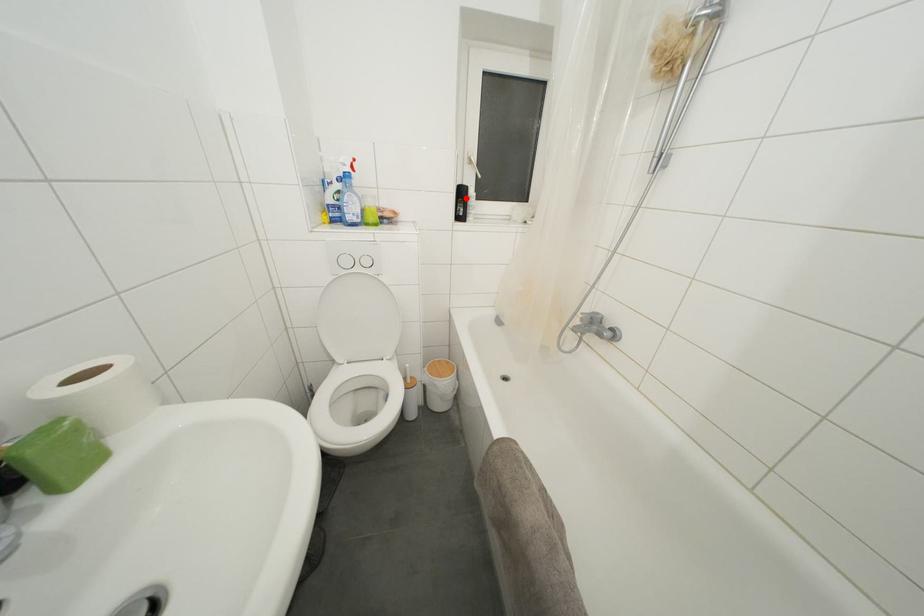
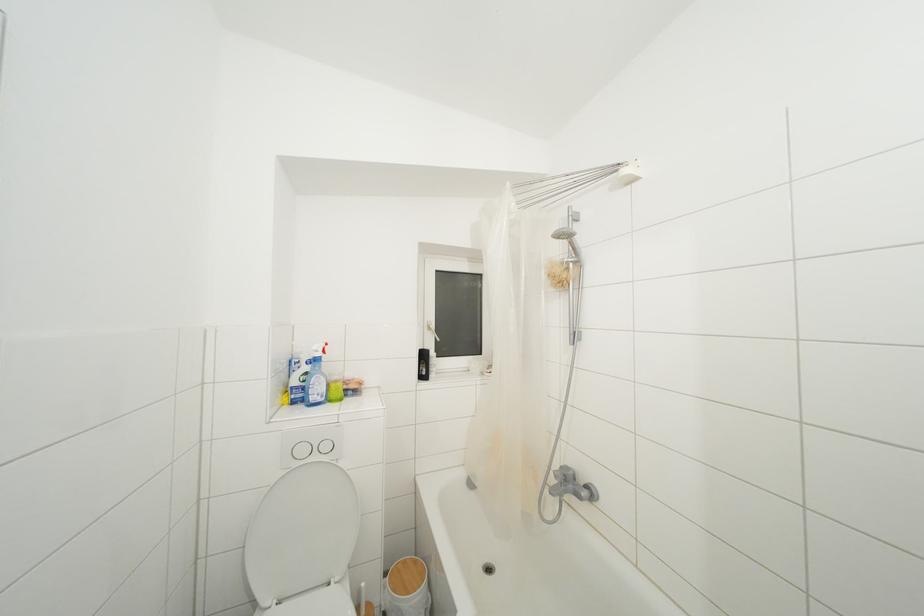
In the second image, find the point that corresponds to the highlighted location in the first image.

(428, 361)